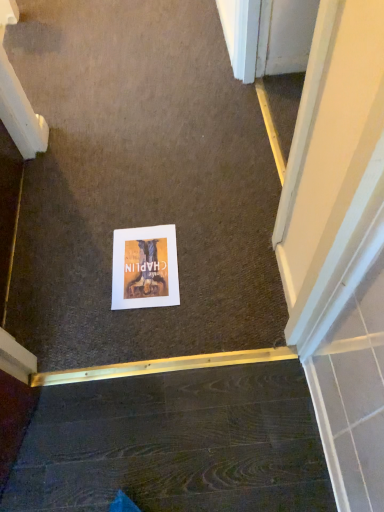
The width and height of the screenshot is (384, 512). I want to click on free space behind white paper at center, so click(132, 220).